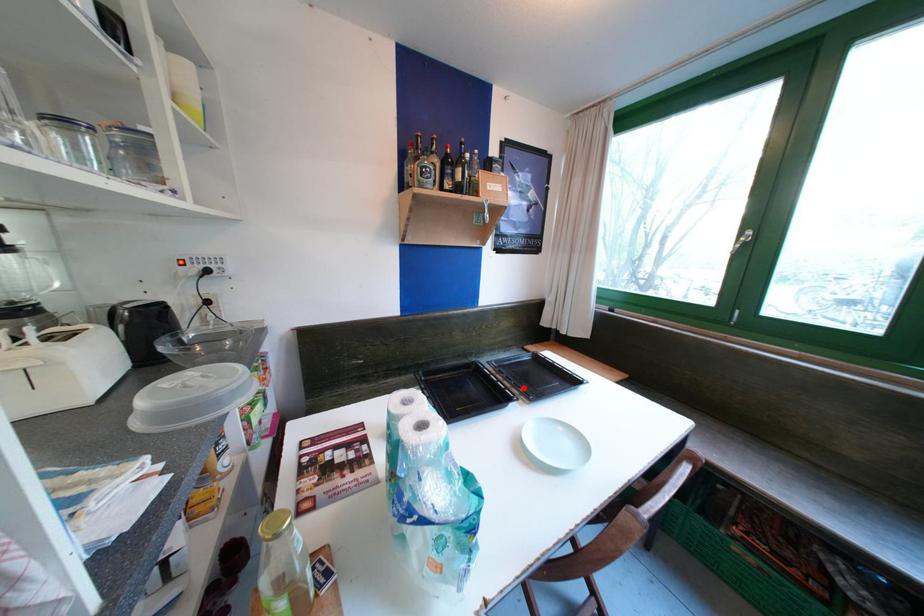
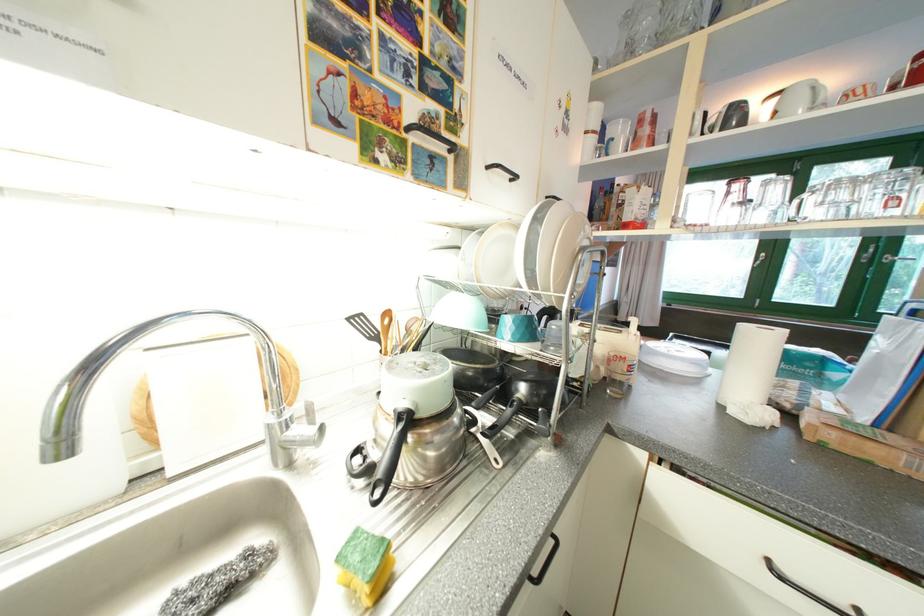
Question: I am providing you with two images of the same scene from different viewpoints. A red point is marked on the first image. Can you still see the location of the red point in image 2?

Choices:
 (A) Yes
 (B) No

Answer: (B)